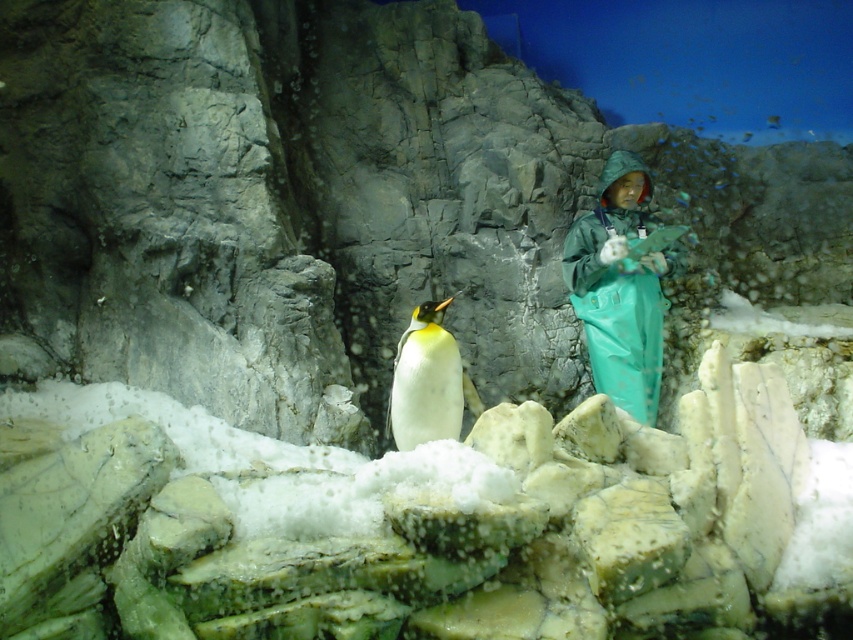
Describe the element at coordinates (619, 288) in the screenshot. I see `green rubber suit at center` at that location.

At what (x,y) coordinates should I click in order to perform the action: click on green rubber suit at center. Please return your answer as a coordinate pair (x, y). This screenshot has width=853, height=640. Looking at the image, I should click on (619, 288).